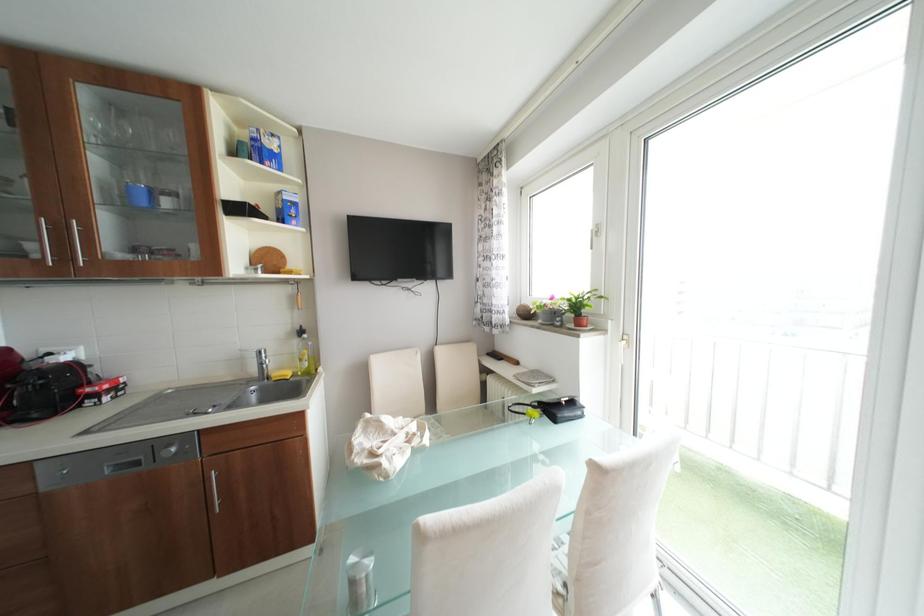
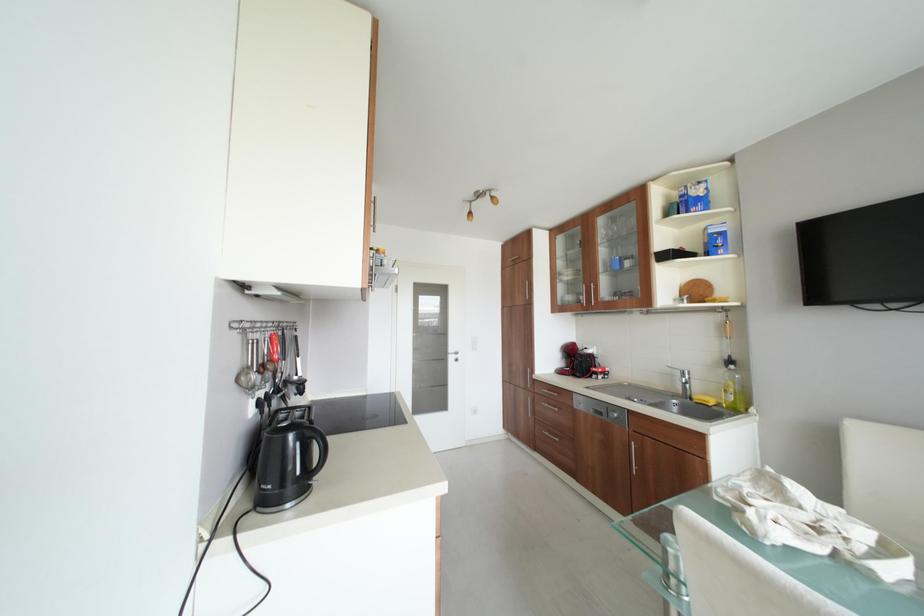
Question: The images are taken continuously from a first-person perspective. In which direction is your viewpoint rotating?

Choices:
 (A) Left
 (B) Right
 (C) Up
 (D) Down

Answer: (A)